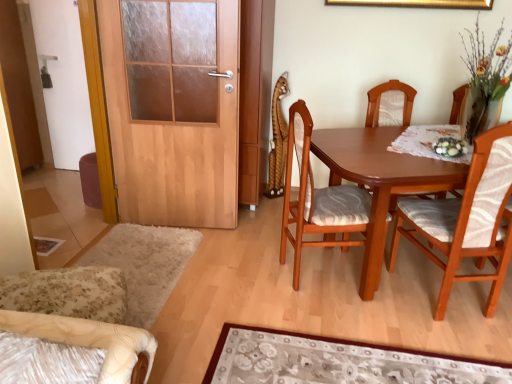
The image size is (512, 384). What are the coordinates of `free area below wooden chair with patterned cushion at right, arranged as the first chair when viewed from the right (from a real-world perspective)` in the screenshot? It's located at (435, 294).